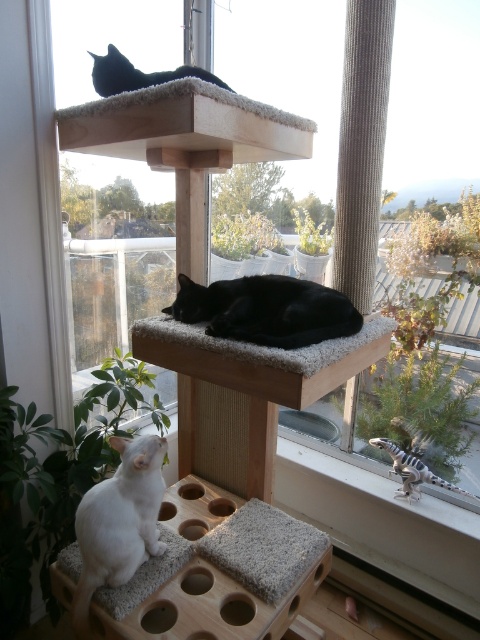
You are designing a cat bed that needs to accommodate both the white fluffy cat at lower left and the black fur cat at center. Based on their sizes, what should be the minimum width of the cat bed to fit both comfortably?

The white fluffy cat at lower left has a lesser width compared to black fur cat at center. Therefore, the minimum width of the cat bed should be at least the width of the black fur cat at center to ensure both can fit comfortably.

You are a cat owner trying to locate your two black cats. You see the black fur cat at center and the black fur cat at upper center. Which cat is located to the right of the other?

The black fur cat at center is positioned on the right side of the black fur cat at upper center.

You are a cat owner trying to place a new toy between the black fur cat at center and the black fur cat at upper center on the cat tree. Based on their sizes, can you safely place the toy in the middle without worrying about them reaching it?

The black fur cat at center might be wider than black fur cat at upper center, so placing the toy in the middle could be risky as the wider cat might reach it easily.